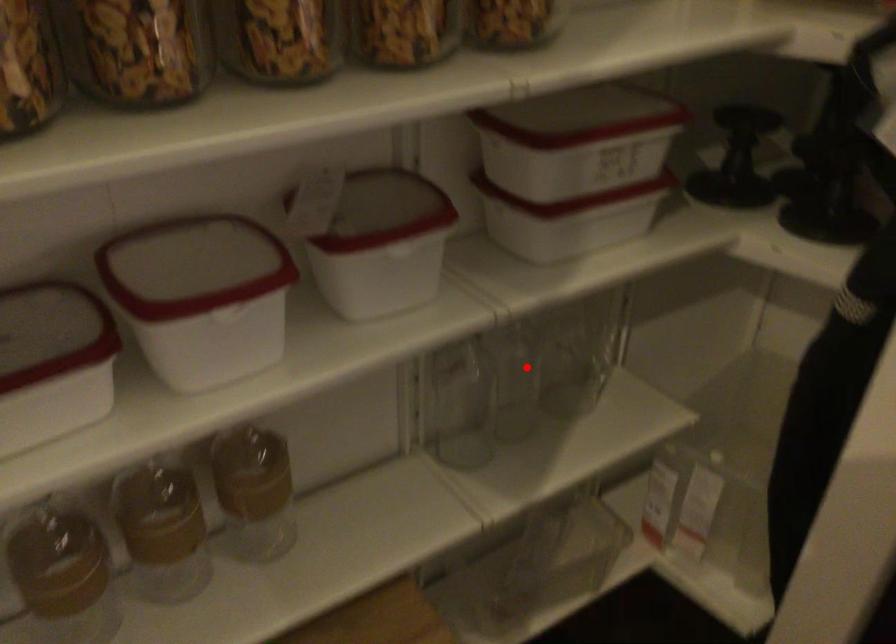
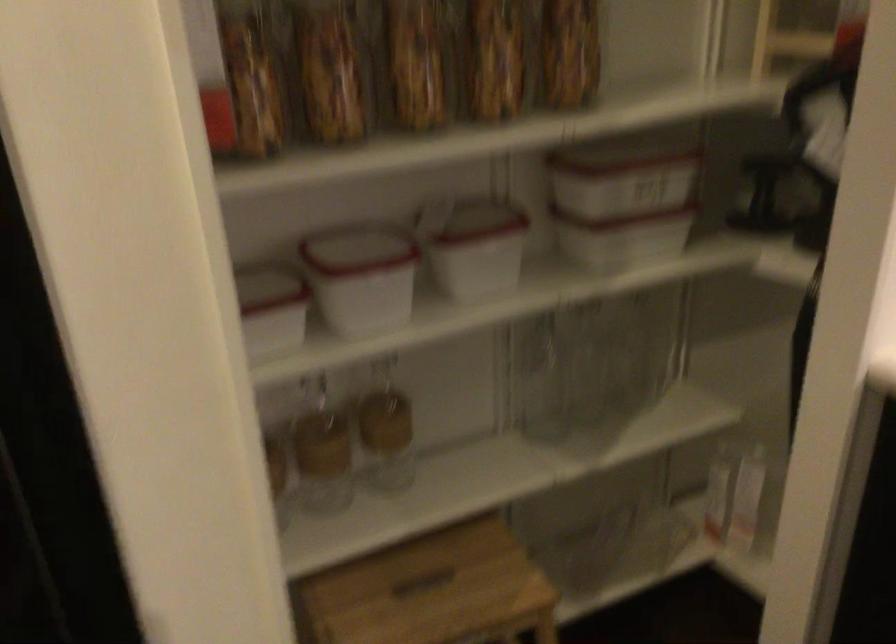
Question: I am providing you with two images of the same scene from different viewpoints. A red point is shown in image1. For the corresponding object point in image2, is it positioned nearer or farther from the camera?

Choices:
 (A) Nearer
 (B) Farther

Answer: (B)